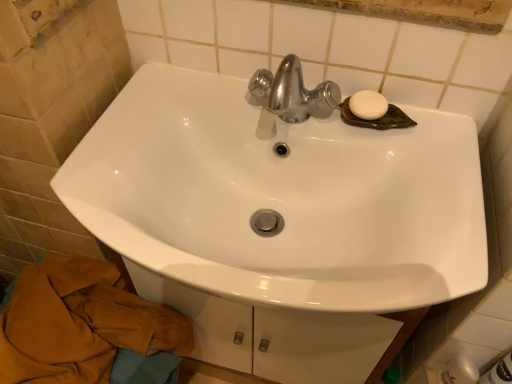
You are a GUI agent. You are given a task and a screenshot of the screen. Output one action in this format:
    pyautogui.click(x=<x>, y=<y>)
    Task: Click on the vacant area that is situated to the right of white matte soap at upper right
    
    Given the screenshot: What is the action you would take?
    pyautogui.click(x=443, y=130)